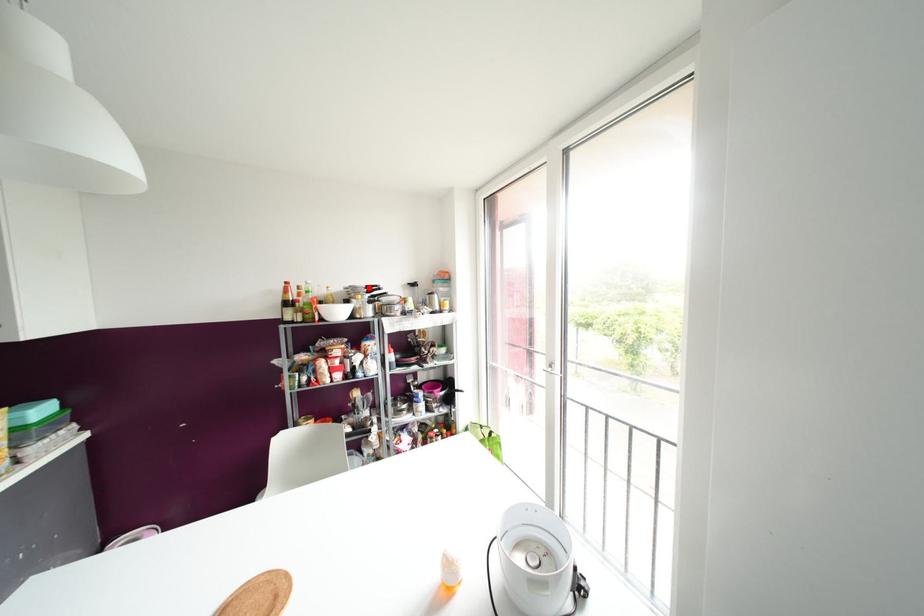
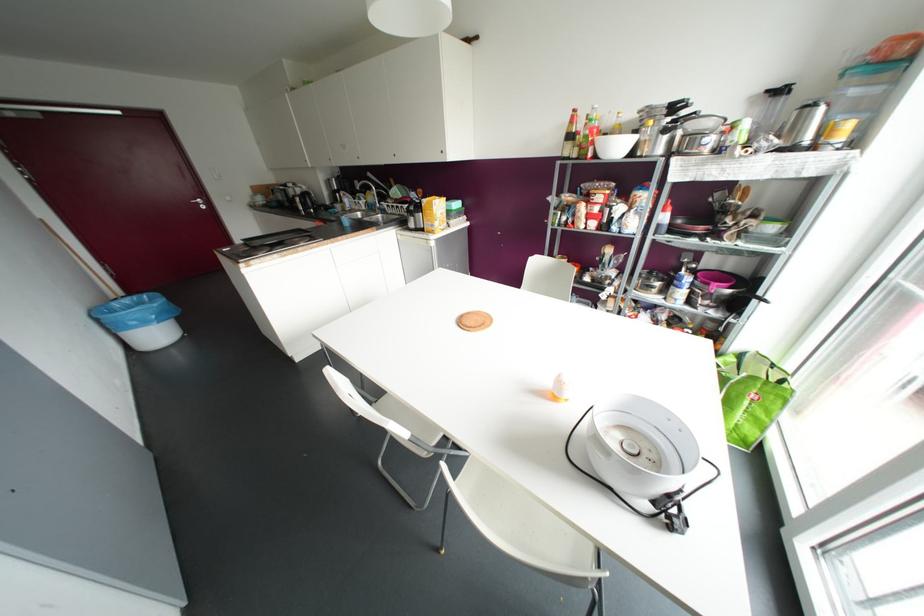
Locate, in the second image, the point that corresponds to the highlighted location in the first image.

(673, 107)